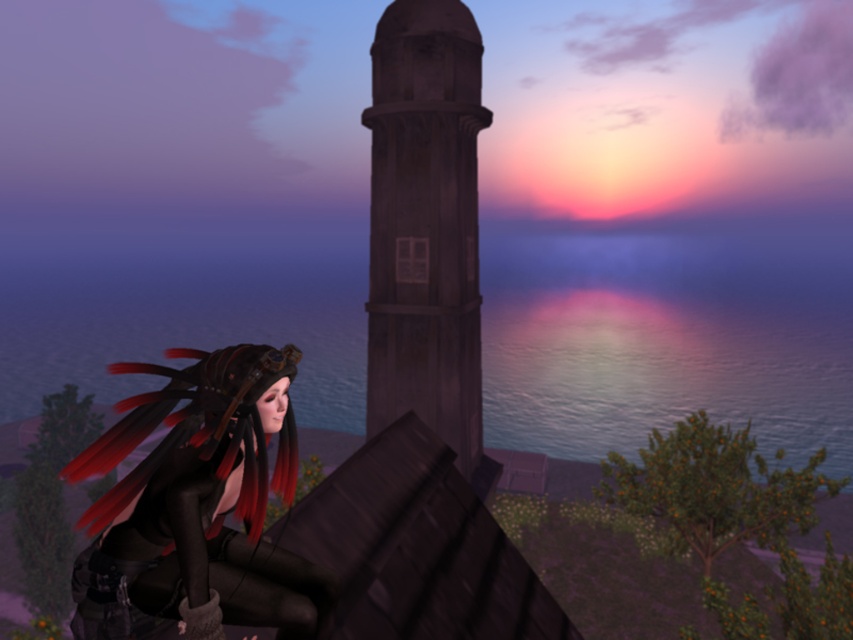
Question: Is shiny black leather boots at lower left to the right of wooden at center from the viewer's perspective?

Choices:
 (A) yes
 (B) no

Answer: (B)

Question: Which of these objects is positioned closest to the wooden at center?

Choices:
 (A) shiny black leather boots at lower left
 (B) glistening blue water at center

Answer: (A)

Question: Is glistening blue water at center behind shiny black leather boots at lower left?

Choices:
 (A) yes
 (B) no

Answer: (A)

Question: Among these objects, which one is nearest to the camera?

Choices:
 (A) glistening blue water at center
 (B) shiny black leather boots at lower left
 (C) wooden at center

Answer: (B)

Question: Which of these objects is positioned closest to the glistening blue water at center?

Choices:
 (A) shiny black leather boots at lower left
 (B) wooden at center

Answer: (B)

Question: Is glistening blue water at center closer to the viewer compared to wooden at center?

Choices:
 (A) no
 (B) yes

Answer: (A)